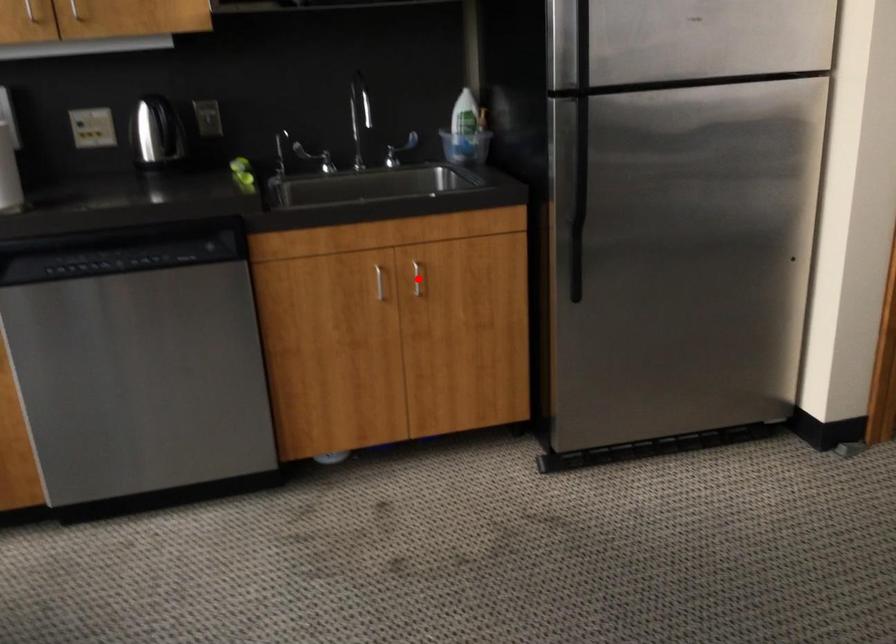
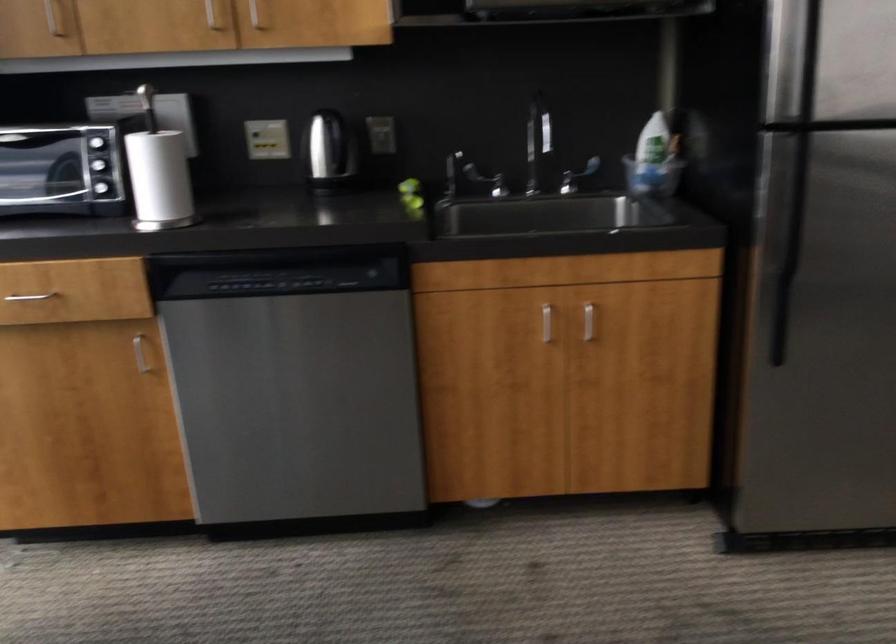
Question: A red point is marked in image1. In image2, is the corresponding 3D point closer to the camera or farther? Reply with the corresponding letter.

Choices:
 (A) The corresponding 3D point is closer.
 (B) The corresponding 3D point is farther.

Answer: (A)